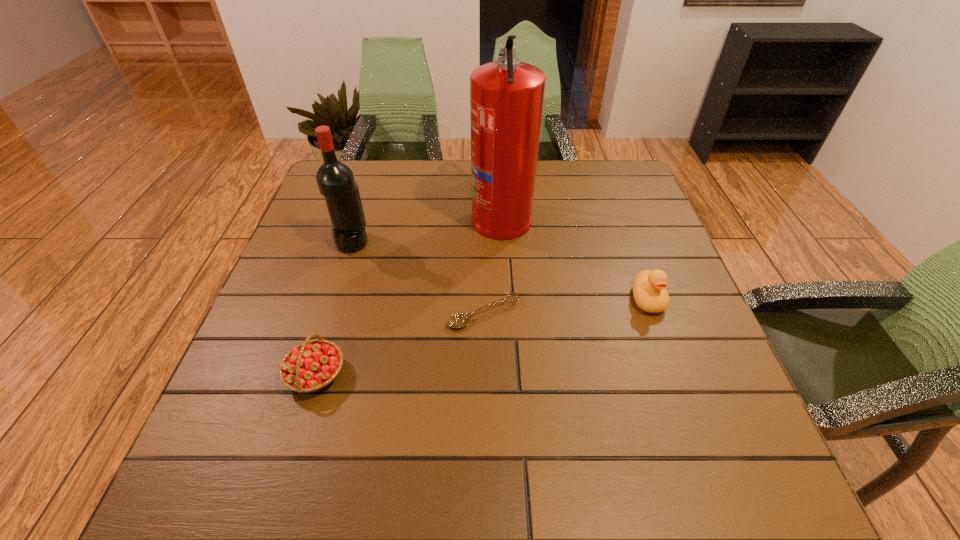
In order to click on free spot located 0.340m on the back of the strawberry in this screenshot , I will do `click(356, 240)`.

Locate an element on the screen. The height and width of the screenshot is (540, 960). blank space located on the back of the ladle is located at coordinates (483, 197).

Locate an element on the screen. The height and width of the screenshot is (540, 960). object located at the far edge is located at coordinates (506, 96).

You are a GUI agent. You are given a task and a screenshot of the screen. Output one action in this format:
    pyautogui.click(x=<x>, y=<y>)
    Task: Click on the wine bottle present at the left edge
    
    Given the screenshot: What is the action you would take?
    pyautogui.click(x=335, y=180)

You are a GUI agent. You are given a task and a screenshot of the screen. Output one action in this format:
    pyautogui.click(x=<x>, y=<y>)
    Task: Click on the strawberry located in the left edge section of the desktop
    This screenshot has height=540, width=960.
    Given the screenshot: What is the action you would take?
    pyautogui.click(x=311, y=366)

Where is `object positioned at the right edge`? object positioned at the right edge is located at coordinates (649, 287).

Find the location of a particular element. This screenshot has width=960, height=540. free space at the far edge is located at coordinates click(449, 178).

Where is `free space at the near edge`? The height and width of the screenshot is (540, 960). free space at the near edge is located at coordinates (337, 487).

Image resolution: width=960 pixels, height=540 pixels. I want to click on vacant point at the left edge, so click(292, 260).

This screenshot has height=540, width=960. What are the coordinates of `free space at the right edge` in the screenshot? It's located at (642, 208).